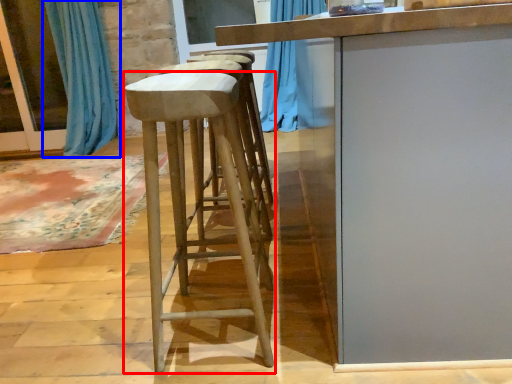
Question: Among these objects, which one is farthest to the camera, stool (highlighted by a red box) or curtain (highlighted by a blue box)?

Choices:
 (A) stool
 (B) curtain

Answer: (B)